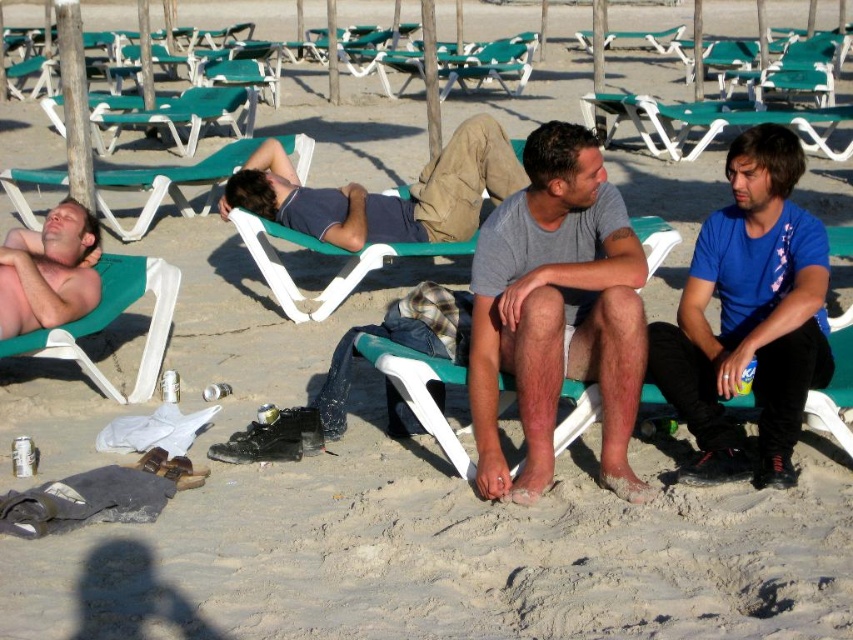
You are a beachgoer who wants to choose a chair that is taller than the other. Which one between the green plastic beach chair at left and the green plastic lounge chair at center should you pick?

The green plastic lounge chair at center is taller than the green plastic beach chair at left, so you should pick the green plastic lounge chair at center.

You are a beach attendant and need to ensure that all lounge chairs are spaced properly. According to the image, which lounge chair takes up more space, the green plastic lounge chair at upper left or the green plastic lounge chair at center?

The green plastic lounge chair at center takes up more space than the green plastic lounge chair at upper left because it occupies more space according to the description.